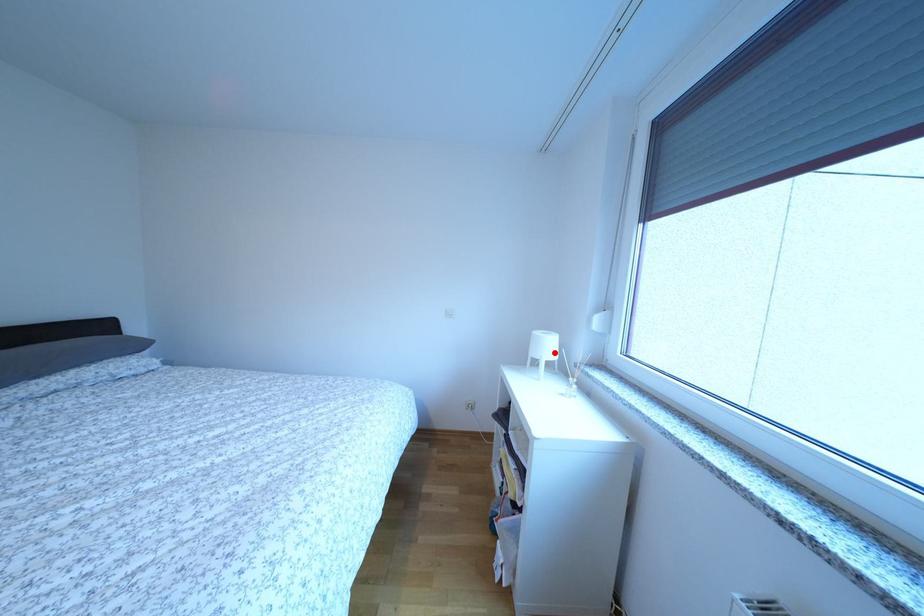
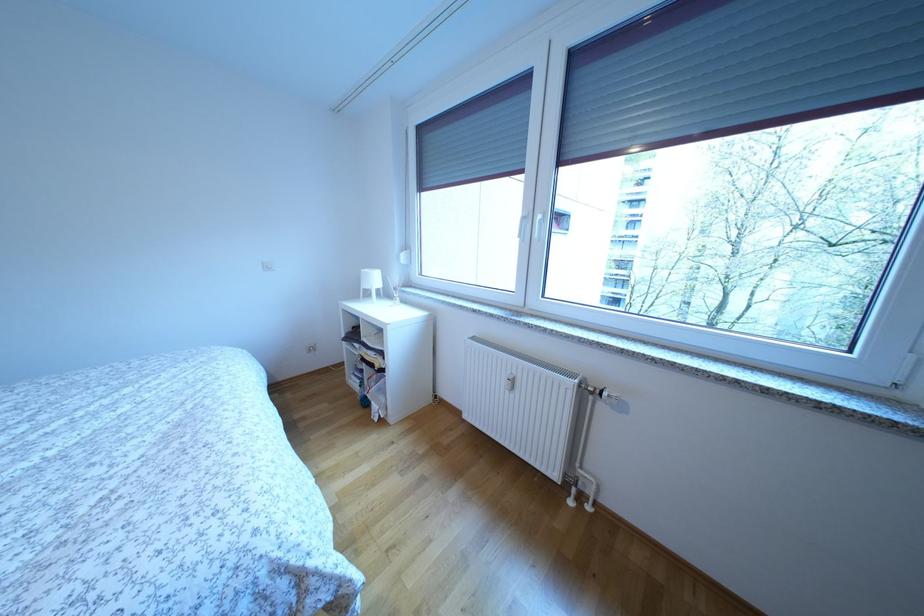
Question: I am providing you with two images of the same scene from different viewpoints. Image1 has a red point marked. In image2, the corresponding 3D location appears at what relative position? Reply with the corresponding letter.

Choices:
 (A) Closer
 (B) Farther

Answer: (A)